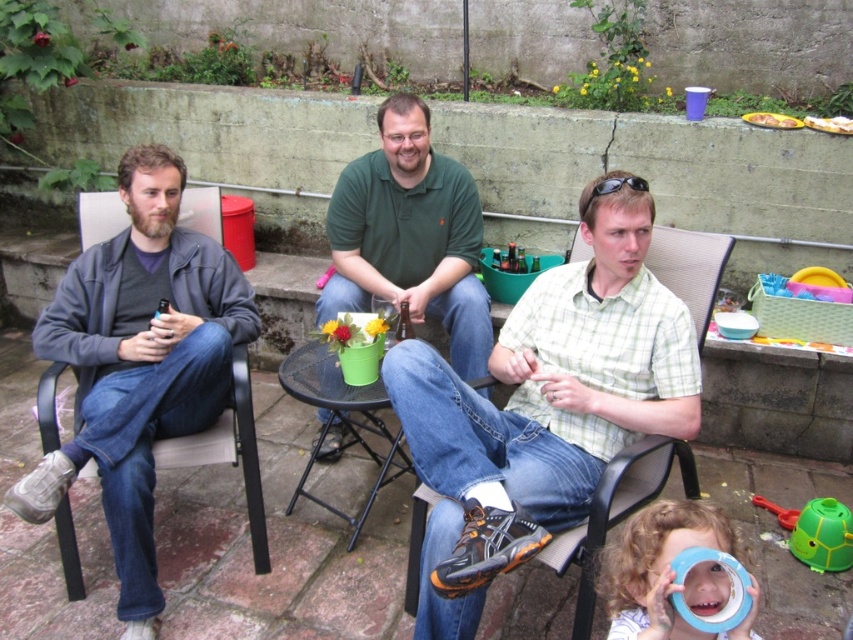
Does green matte shirt at center have a lesser height compared to matte plastic chair at center?

No, green matte shirt at center is not shorter than matte plastic chair at center.

Is point (343, 220) behind point (663, 452)?

Yes, point (343, 220) is behind point (663, 452).

At what (x,y) coordinates should I click in order to perform the action: click on green matte shirt at center. Please return your answer as a coordinate pair (x, y). Looking at the image, I should click on (409, 236).

Is matte plastic chair at center positioned in front of yellow plastic tray at upper right?

Yes, it is in front of yellow plastic tray at upper right.

Which is above, matte plastic chair at center or yellow plastic tray at upper right?

yellow plastic tray at upper right is above.

Find the location of a particular element. matte plastic chair at center is located at coordinates (616, 512).

What are the coordinates of `matte plastic chair at center` in the screenshot? It's located at (616, 512).

Is matte plastic chair at center above green plastic table at center?

Actually, matte plastic chair at center is below green plastic table at center.

Who is positioned more to the right, matte plastic chair at center or green plastic table at center?

Positioned to the right is matte plastic chair at center.

Where is `matte plastic chair at center`? matte plastic chair at center is located at coordinates (616, 512).